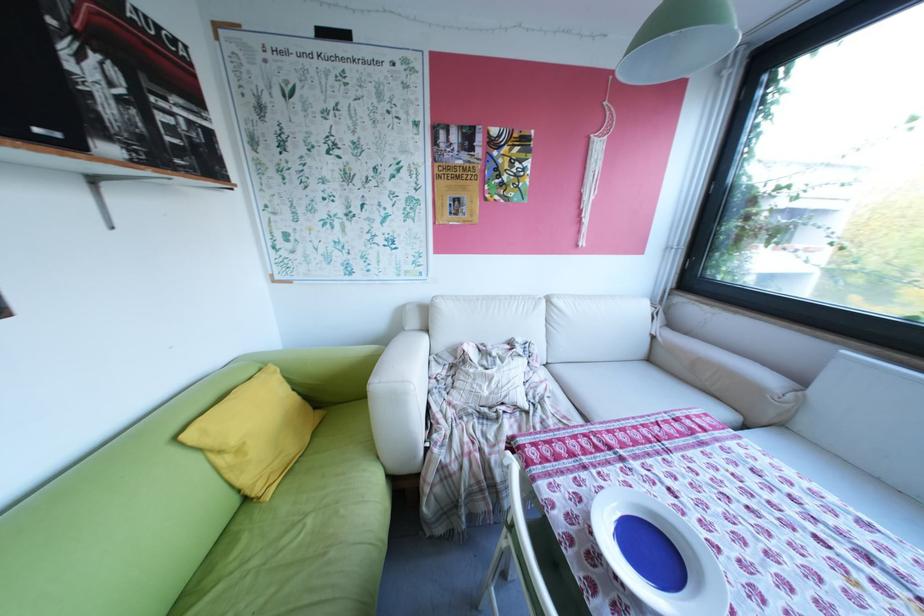
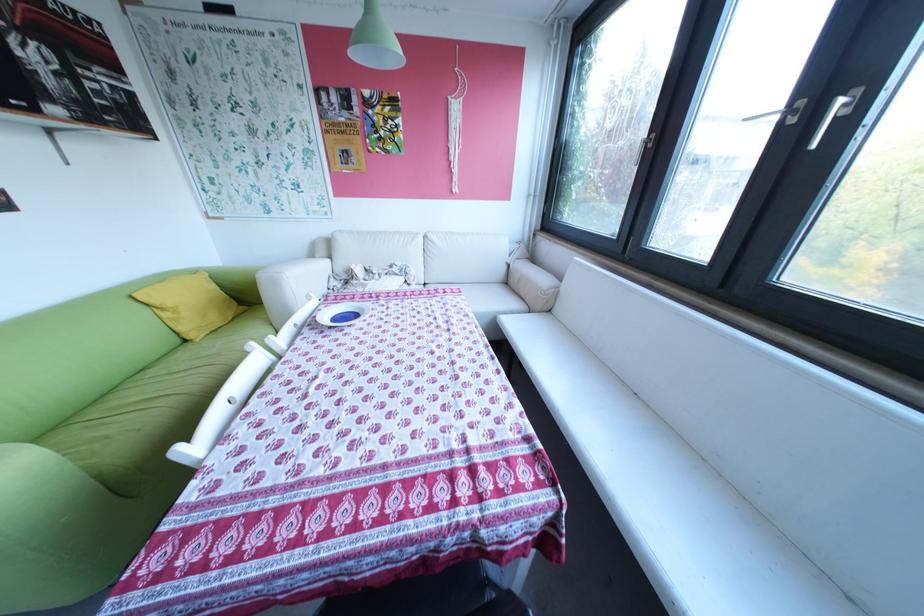
Locate, in the second image, the point that corresponds to pixel 237 460 in the first image.

(177, 314)